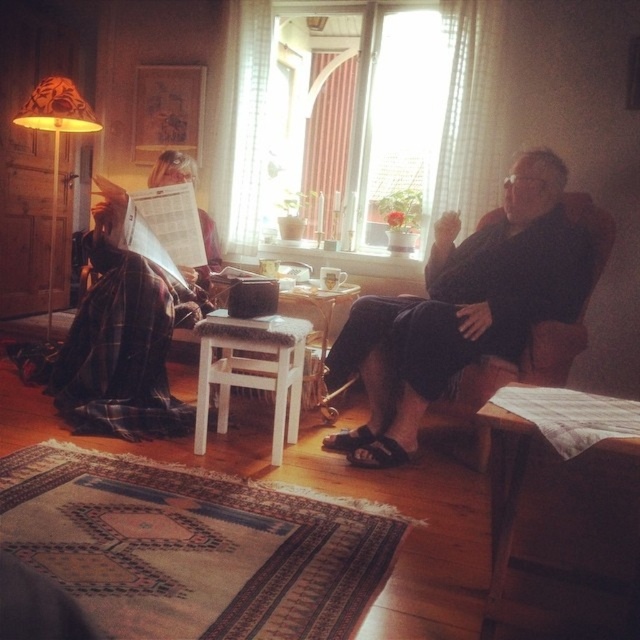
Question: Is translucent fabric window at center in front of white wooden stool at center?

Choices:
 (A) no
 (B) yes

Answer: (A)

Question: Based on their relative distances, which object is farther from the translucent fabric window at center?

Choices:
 (A) white wooden stool at center
 (B) orange fabric lampshade at left
 (C) dark blue fabric chair at center

Answer: (B)

Question: Which point is farther from the camera taking this photo?

Choices:
 (A) (35, 97)
 (B) (262, 131)
 (C) (228, 316)

Answer: (B)

Question: Which is farther from the dark blue fabric chair at center?

Choices:
 (A) orange fabric lampshade at left
 (B) translucent fabric window at center

Answer: (A)

Question: Where is translucent fabric window at center located in relation to dark blue fabric chair at center in the image?

Choices:
 (A) below
 (B) above

Answer: (B)

Question: Can you confirm if translucent fabric window at center is positioned below orange fabric lampshade at left?

Choices:
 (A) yes
 (B) no

Answer: (B)